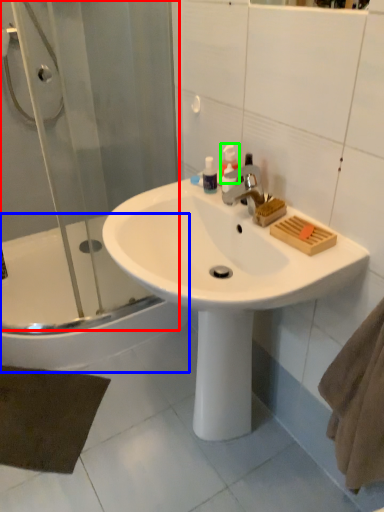
Question: Based on their relative distances, which object is farther from shower door (highlighted by a red box)? Choose from bathtub (highlighted by a blue box) and soap dispenser (highlighted by a green box).

Choices:
 (A) bathtub
 (B) soap dispenser

Answer: (B)